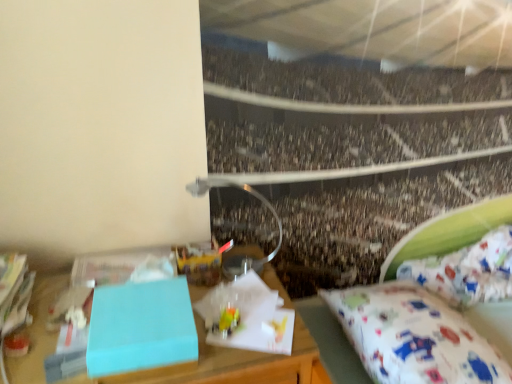
Question: From the image's perspective, is speckled concrete crowd at center located above or below metallic silver lamp at upper center?

Choices:
 (A) above
 (B) below

Answer: (A)

Question: From a real-world perspective, is speckled concrete crowd at center positioned above or below metallic silver lamp at upper center?

Choices:
 (A) above
 (B) below

Answer: (B)

Question: Estimate the real-world distances between objects in this image. Which object is closer to the matte blue box at center?

Choices:
 (A) light blue matte box at left
 (B) white fabric mattress at lower right
 (C) metallic silver lamp at upper center
 (D) speckled concrete crowd at center

Answer: (A)

Question: Estimate the real-world distances between objects in this image. Which object is farther from the metallic silver lamp at upper center?

Choices:
 (A) matte blue box at center
 (B) light blue matte box at left
 (C) speckled concrete crowd at center
 (D) white fabric mattress at lower right

Answer: (D)